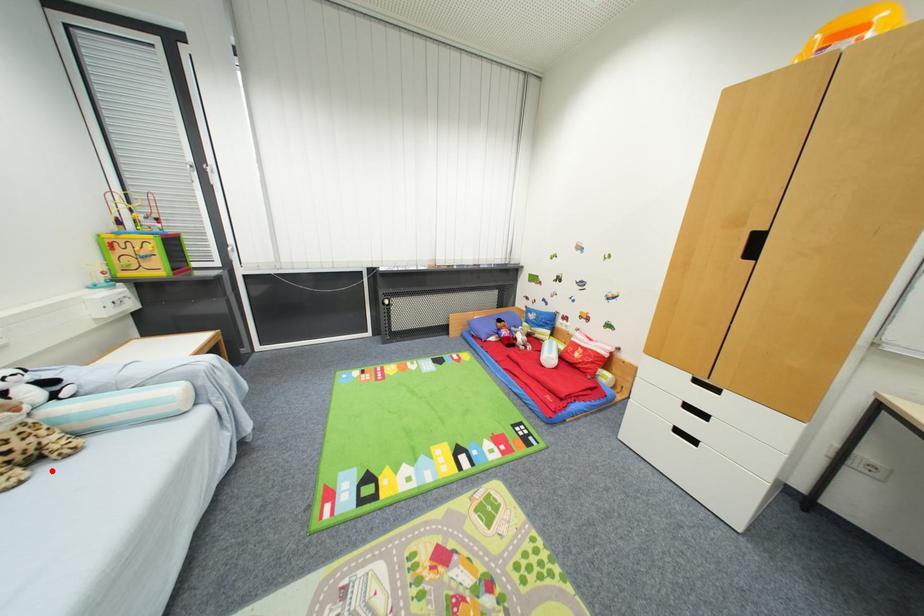
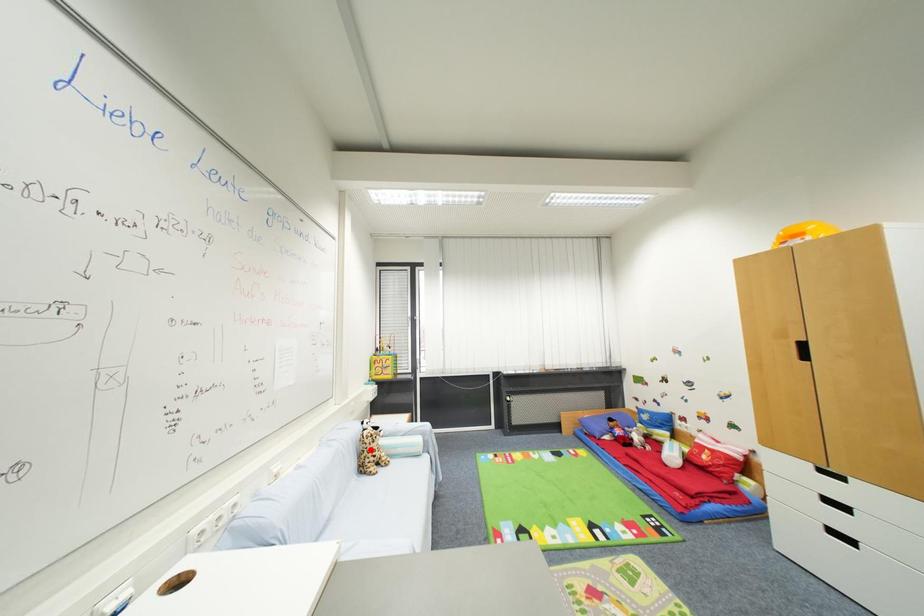
I am providing you with two images of the same scene from different viewpoints. A red point is marked on the first image and another point is marked on the second image. Is the red point in image1 aligned with the point shown in image2?

No